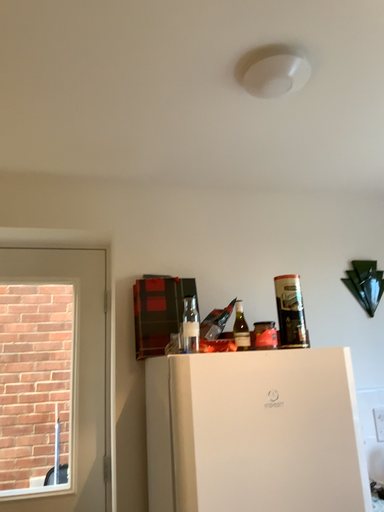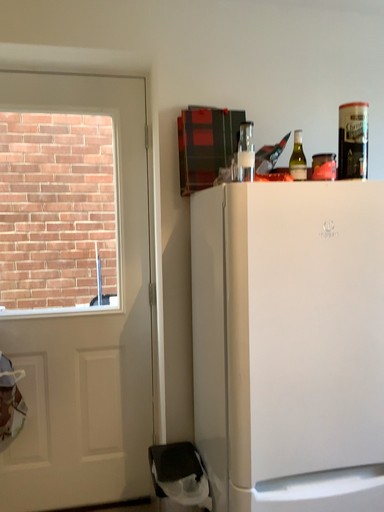
Question: How did the camera likely rotate when shooting the video?

Choices:
 (A) rotated upward
 (B) rotated downward

Answer: (B)